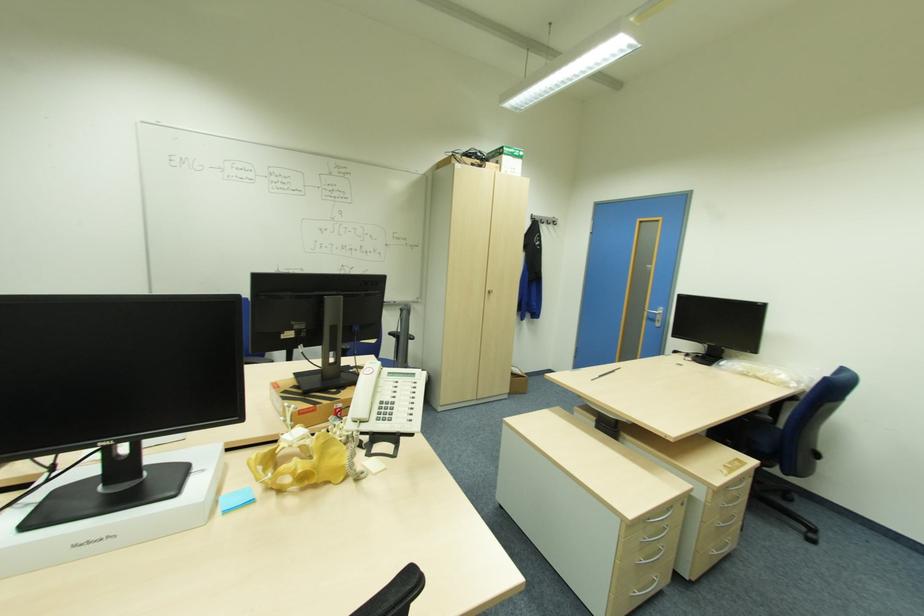
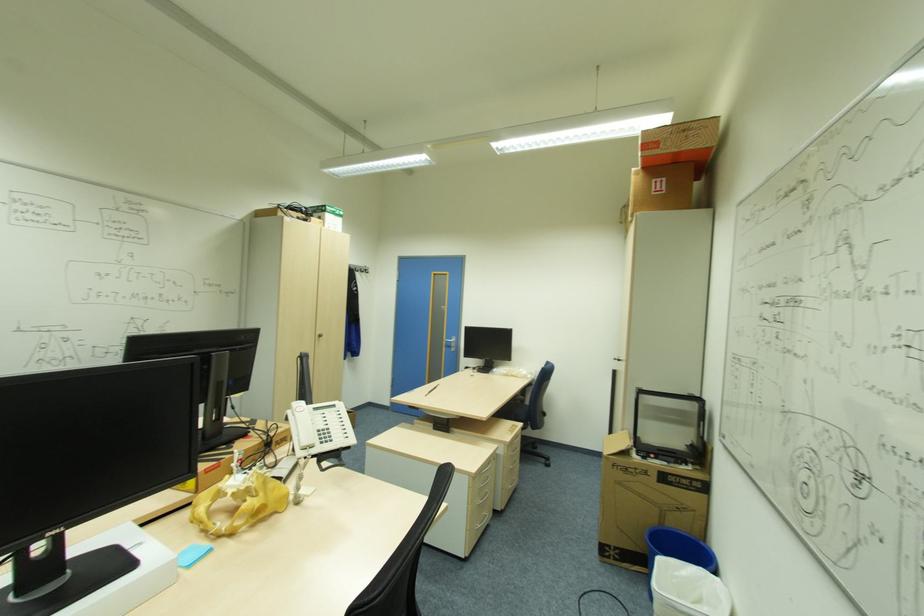
Question: The images are taken continuously from a first-person perspective. In which direction is your viewpoint rotating?

Choices:
 (A) Left
 (B) Right
 (C) Up
 (D) Down

Answer: (B)